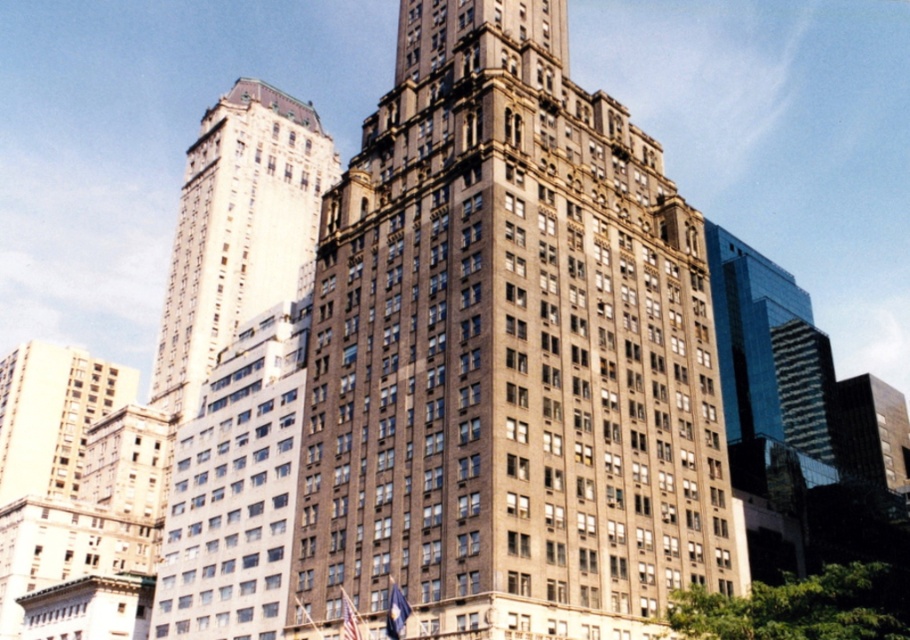
You are standing in the city square and want to take a photo of both the brown stone building at center and the white glass tower at upper left. Which building should you position yourself closer to in order to capture both in the same frame?

You should position yourself closer to the brown stone building at center because it is closer to the viewer than the white glass tower at upper left, allowing both to be in the same frame when you focus on the nearer one.

You are an architect evaluating the urban skyline. You observe the brown stone building at center and the white glass tower at upper left. Which structure has a greater height?

The brown stone building at center has a greater height compared to the white glass tower at upper left.